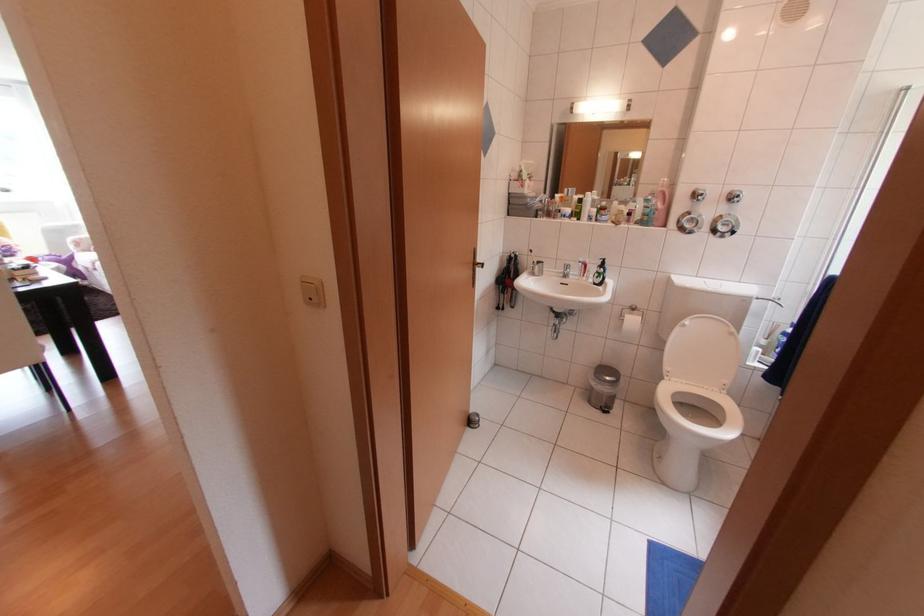
Describe the element at coordinates (479, 265) in the screenshot. This screenshot has width=924, height=616. I see `the metal door handle` at that location.